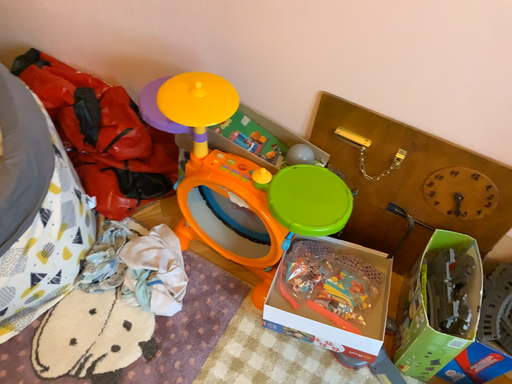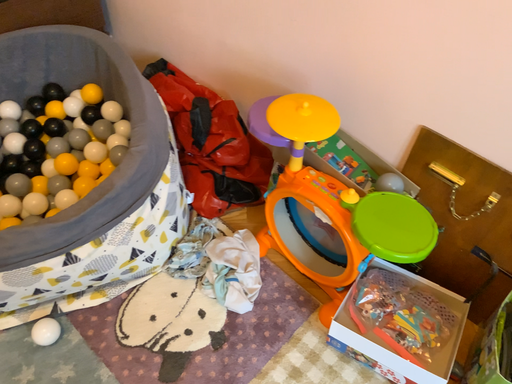
Question: Which way did the camera rotate in the video?

Choices:
 (A) rotated left
 (B) rotated right

Answer: (A)